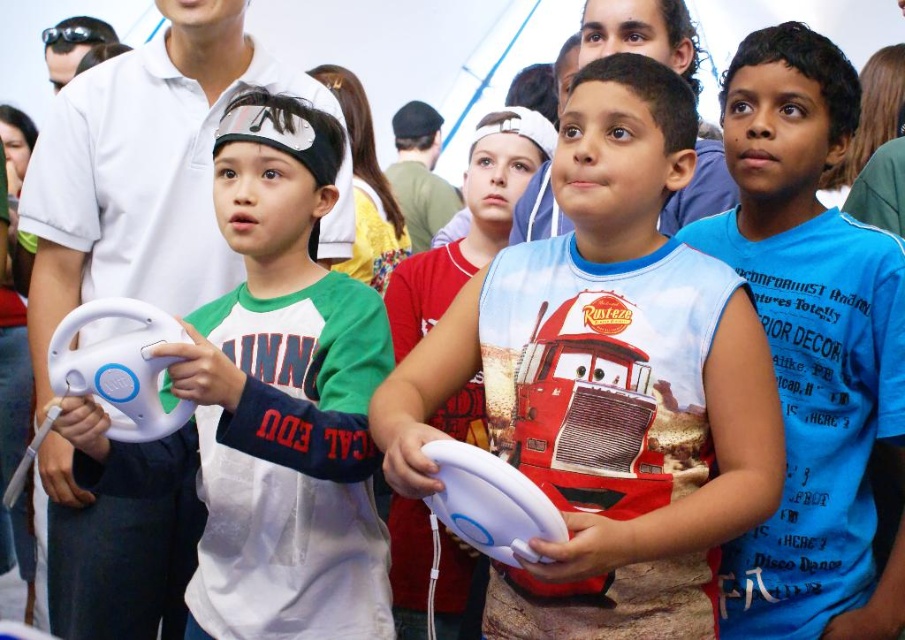
From the picture: What is the location of the point with coordinates (x=607, y=381) in the image?

The point with coordinates (x=607, y=381) is located on the white matte controller at center.

You are a game developer designing a new controller. You want to ensure the new controller is smaller than the blue cotton shirt at center. Based on the scene, is the white matte controller at center a good reference for the size you need?

The white matte controller at center is larger than the blue cotton shirt at center. Therefore, it is not a good reference for a controller smaller than the blue cotton shirt at center.